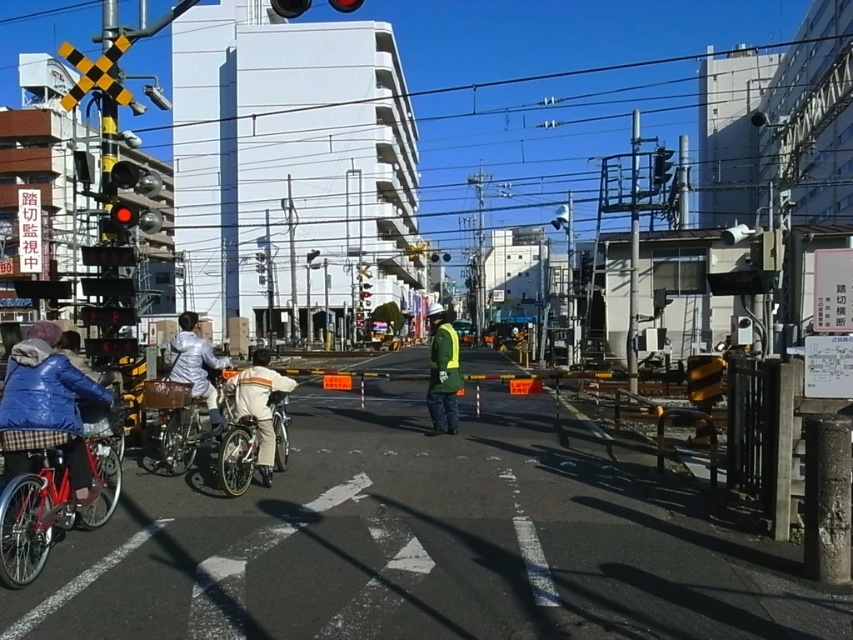
Question: Which object appears closest to the camera in this image?

Choices:
 (A) blue glass traffic light at upper center
 (B) shiny red bicycle at lower left
 (C) reflective yellow vest at center

Answer: (B)

Question: Is metallic silver bicycle at center above reflective yellow vest at center?

Choices:
 (A) yes
 (B) no

Answer: (B)

Question: Which of the following is the farthest from the observer?

Choices:
 (A) metallic silver bicycle at center
 (B) shiny red bicycle at lower left

Answer: (A)

Question: Estimate the real-world distances between objects in this image. Which object is closer to the shiny red bicycle at lower left?

Choices:
 (A) metallic silver bicycle at center
 (B) silver metallic bicycle at left
 (C) reflective yellow vest at center

Answer: (A)

Question: Can you confirm if reflective yellow vest at center is positioned above silver metallic bicycle at left?

Choices:
 (A) yes
 (B) no

Answer: (B)

Question: From the image, what is the correct spatial relationship of metallic silver bicycle at left in relation to reflective yellow vest at center?

Choices:
 (A) left
 (B) right

Answer: (A)